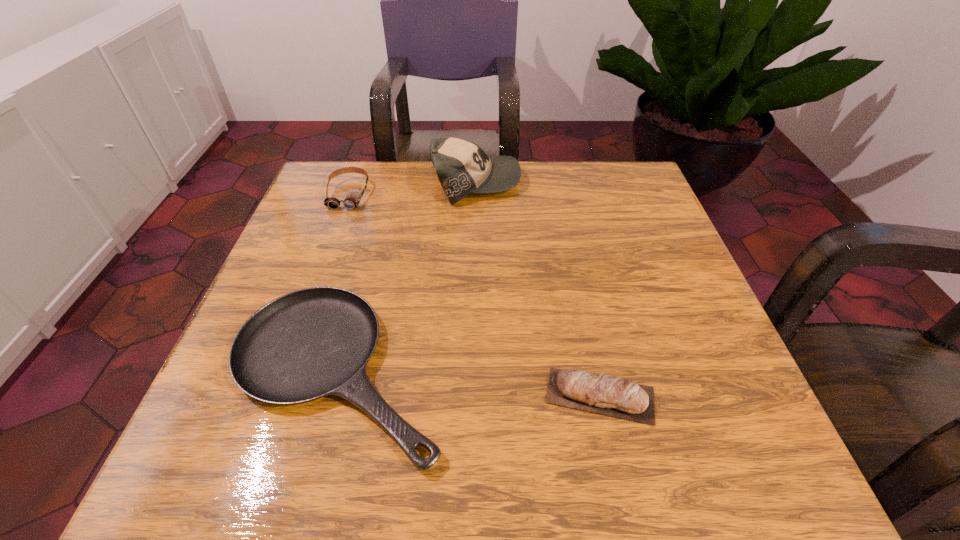
Identify the location of empty space that is in between the goggles and the pita bread. The height and width of the screenshot is (540, 960). (474, 294).

Identify the location of free point between the frying pan and the rightmost object. This screenshot has height=540, width=960. (468, 383).

Where is `empty location between the pita bread and the shortest object`? empty location between the pita bread and the shortest object is located at coordinates (468, 383).

Locate an element on the screen. object that stands as the closest to the pita bread is located at coordinates (307, 344).

Identify which object is the second closest to the baseball cap. Please provide its 2D coordinates. Your answer should be formatted as a tuple, i.e. [(x, y)], where the tuple contains the x and y coordinates of a point satisfying the conditions above.

[(307, 344)]

Where is `free space that satisfies the following two spatial constraints: 1. on the front-facing side of the pita bread; 2. on the left side of the goggles`? free space that satisfies the following two spatial constraints: 1. on the front-facing side of the pita bread; 2. on the left side of the goggles is located at coordinates (275, 395).

The width and height of the screenshot is (960, 540). What are the coordinates of `vacant space that satisfies the following two spatial constraints: 1. on the front-facing side of the tallest object; 2. on the front-facing side of the goggles` in the screenshot? It's located at (476, 193).

The width and height of the screenshot is (960, 540). Find the location of `free space in the image that satisfies the following two spatial constraints: 1. on the front-facing side of the goggles; 2. on the right side of the rightmost object`. free space in the image that satisfies the following two spatial constraints: 1. on the front-facing side of the goggles; 2. on the right side of the rightmost object is located at coordinates (275, 395).

Image resolution: width=960 pixels, height=540 pixels. Find the location of `free space that satisfies the following two spatial constraints: 1. on the front-facing side of the pita bread; 2. on the right side of the goggles`. free space that satisfies the following two spatial constraints: 1. on the front-facing side of the pita bread; 2. on the right side of the goggles is located at coordinates (275, 395).

Where is `blank space that satisfies the following two spatial constraints: 1. on the front-facing side of the baseball cap; 2. on the front side of the shortest object`? The image size is (960, 540). blank space that satisfies the following two spatial constraints: 1. on the front-facing side of the baseball cap; 2. on the front side of the shortest object is located at coordinates (473, 370).